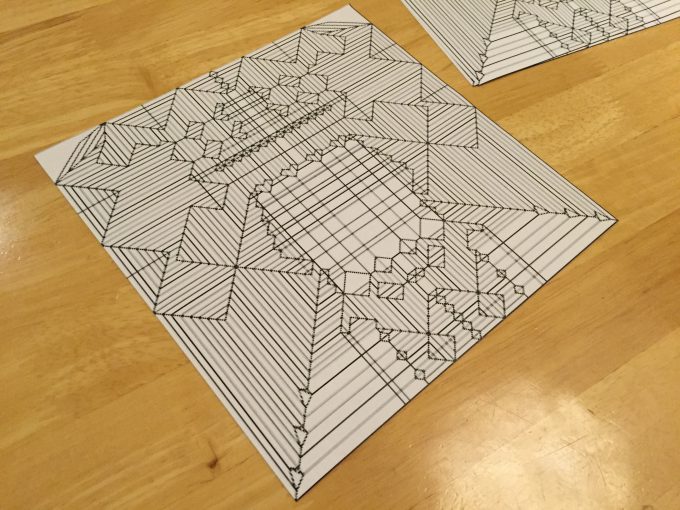
Locate an element on the screen. Image resolution: width=680 pixels, height=510 pixels. top tile is located at coordinates (483, 30).